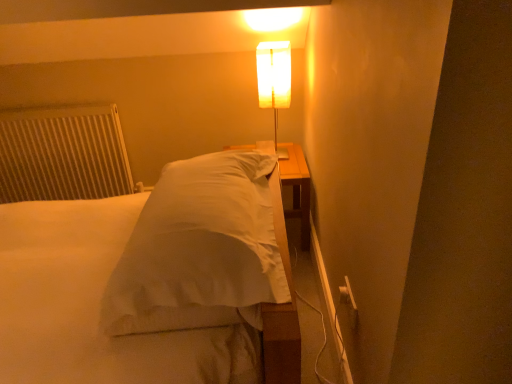
The height and width of the screenshot is (384, 512). I want to click on free space above translucent white lamp at upper center (from a real-world perspective), so click(272, 47).